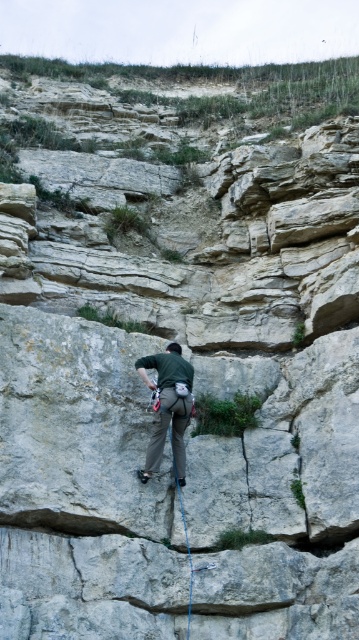
Based on the photo, can you confirm if green fabric climbing harness at center is positioned below blue nylon rope at center?

Incorrect, green fabric climbing harness at center is not positioned below blue nylon rope at center.

You are a GUI agent. You are given a task and a screenshot of the screen. Output one action in this format:
    pyautogui.click(x=<x>, y=<y>)
    Task: Click on the green fabric climbing harness at center
    This screenshot has height=640, width=359.
    Given the screenshot: What is the action you would take?
    pyautogui.click(x=168, y=406)